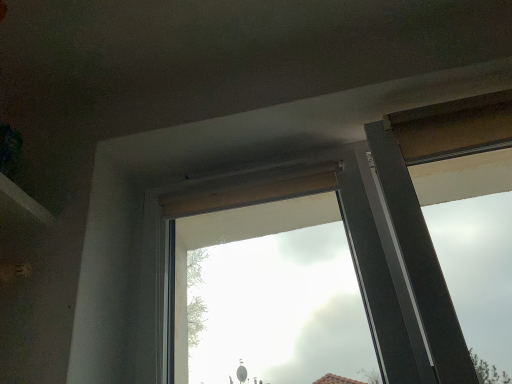
This screenshot has height=384, width=512. Identify the location of white matte window sill at upper left. (25, 201).

Image resolution: width=512 pixels, height=384 pixels. What do you see at coordinates (25, 201) in the screenshot? I see `white matte window sill at upper left` at bounding box center [25, 201].

Measure the distance between white matte window sill at upper left and camera.

They are 1.02 meters apart.

The width and height of the screenshot is (512, 384). What are the coordinates of `white matte window sill at upper left` in the screenshot? It's located at (25, 201).